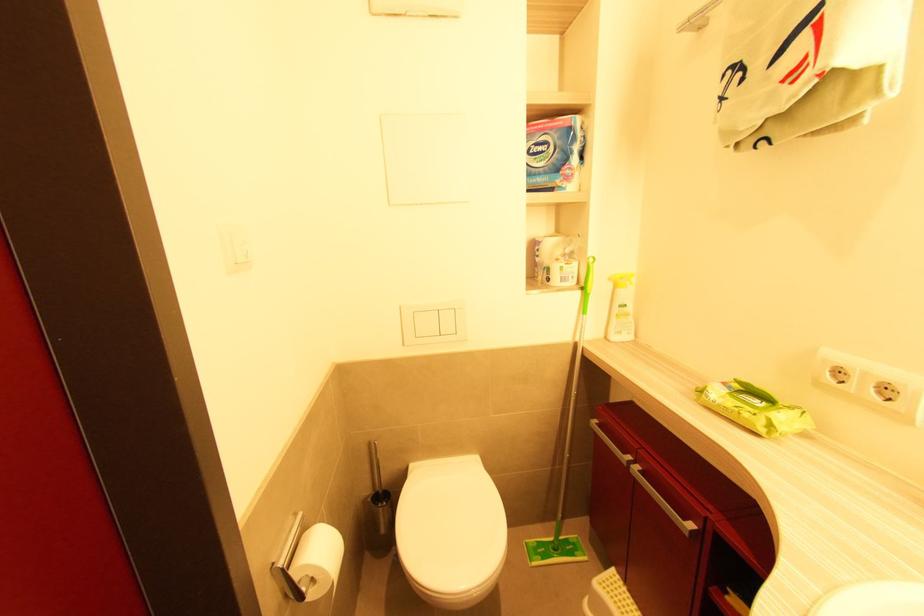
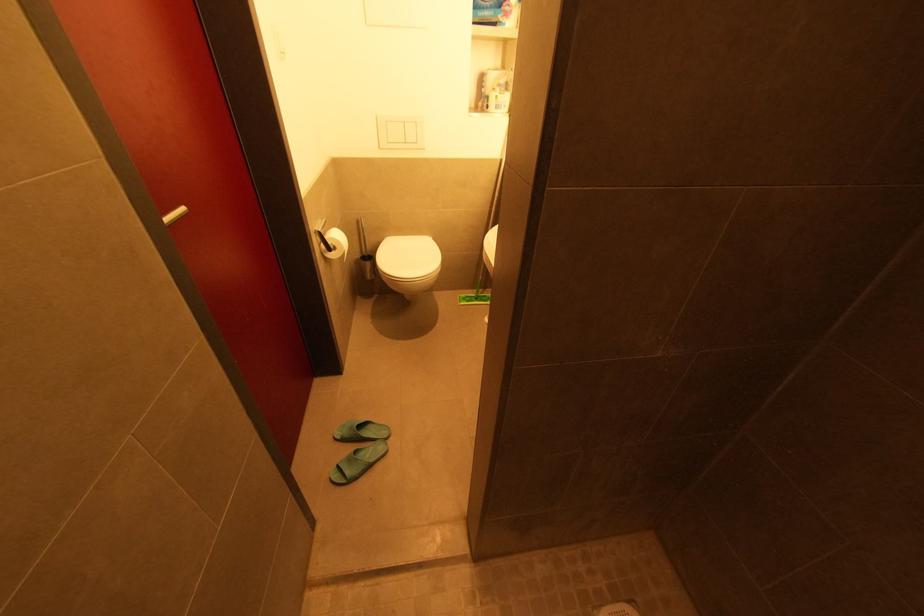
Question: The images are taken continuously from a first-person perspective. In which direction are you moving?

Choices:
 (A) Left
 (B) Right
 (C) Forward
 (D) Backward

Answer: (D)